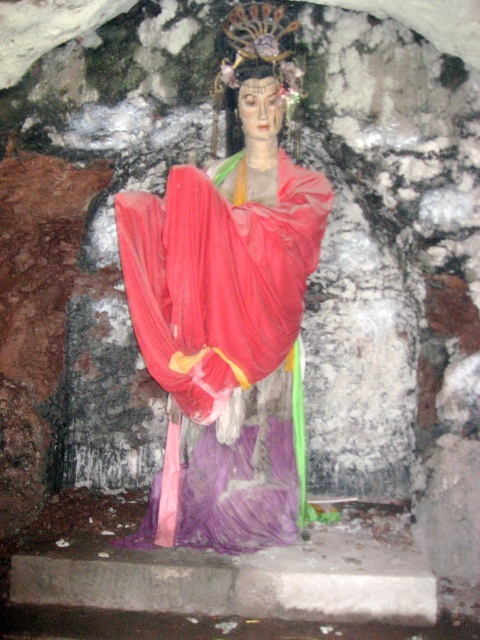
Is matte red silk robe at center further to the viewer compared to matte gold head at center?

No, it is not.

Between point (289, 381) and point (261, 68), which one is positioned behind?

The point (289, 381) is behind.

The height and width of the screenshot is (640, 480). Find the location of `matte red silk robe at center`. matte red silk robe at center is located at coordinates (227, 340).

Locate an element on the screen. The width and height of the screenshot is (480, 640). matte red silk robe at center is located at coordinates (227, 340).